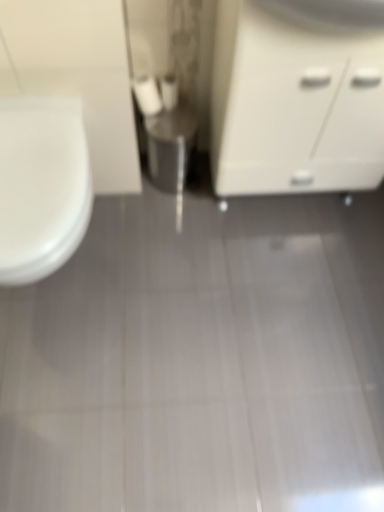
Locate an element on the screen. free location in front of white glossy toilet at left is located at coordinates (76, 396).